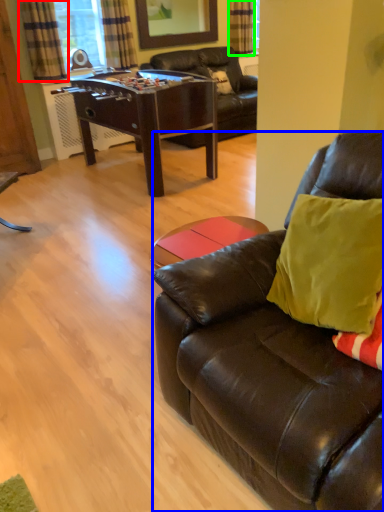
Question: Which is farther away from curtain (highlighted by a red box)? studio couch (highlighted by a blue box) or curtain (highlighted by a green box)?

Choices:
 (A) studio couch
 (B) curtain

Answer: (A)